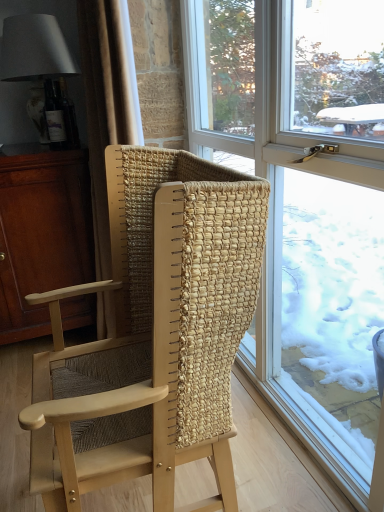
Describe the element at coordinates (154, 334) in the screenshot. Image resolution: width=384 pixels, height=512 pixels. I see `natural woven wood chair at center` at that location.

The image size is (384, 512). What do you see at coordinates (41, 232) in the screenshot?
I see `matte brown cabinet at left` at bounding box center [41, 232].

What do you see at coordinates (306, 206) in the screenshot?
I see `clear glass window at center` at bounding box center [306, 206].

Locate an element on the screen. clear glass window at center is located at coordinates (306, 206).

Find the location of a particular element. natural woven wood chair at center is located at coordinates (154, 334).

Between natural woven wood chair at center and beige woven curtain at left, which one has larger width?

natural woven wood chair at center.

You are a GUI agent. You are given a task and a screenshot of the screen. Output one action in this format:
    pyautogui.click(x=<x>, y=<y>)
    Task: Click on the chair below the beige woven curtain at left (from the image's perspective)
    This screenshot has width=384, height=512.
    Given the screenshot: What is the action you would take?
    pyautogui.click(x=154, y=334)

Is natural woven wood chair at center turned away from beige woven curtain at left?

No, natural woven wood chair at center is not facing the opposite direction of beige woven curtain at left.

From the image's perspective, which is above, natural woven wood chair at center or beige woven curtain at left?

From the image's view, beige woven curtain at left is above.

Can you tell me how much matte white lampshade at upper left and beige woven curtain at left differ in facing direction?

89.2 degrees separate the facing orientations of matte white lampshade at upper left and beige woven curtain at left.

Can you confirm if matte white lampshade at upper left is positioned to the left of beige woven curtain at left?

Correct, you'll find matte white lampshade at upper left to the left of beige woven curtain at left.

From the image's perspective, is matte white lampshade at upper left located beneath beige woven curtain at left?

Incorrect, from the image's perspective, matte white lampshade at upper left is higher than beige woven curtain at left.

Which is in front, matte white lampshade at upper left or beige woven curtain at left?

beige woven curtain at left is closer to the camera.

Could you tell me if natural woven wood chair at center is turned towards clear glass window at center?

No, natural woven wood chair at center is not turned towards clear glass window at center.

Can you confirm if natural woven wood chair at center is positioned to the left of clear glass window at center?

Indeed, natural woven wood chair at center is positioned on the left side of clear glass window at center.

Which object is further away from the camera, natural woven wood chair at center or clear glass window at center?

clear glass window at center is further from the camera.

Choose the correct answer: Is clear glass window at center inside matte white lampshade at upper left or outside it?

clear glass window at center lies outside matte white lampshade at upper left.

Consider the image. Between clear glass window at center and matte white lampshade at upper left, which one appears on the left side from the viewer's perspective?

Positioned to the left is matte white lampshade at upper left.

Considering the sizes of objects clear glass window at center and matte white lampshade at upper left in the image provided, who is shorter, clear glass window at center or matte white lampshade at upper left?

matte white lampshade at upper left is shorter.

Looking at their sizes, would you say clear glass window at center is wider or thinner than matte white lampshade at upper left?

Considering their sizes, clear glass window at center looks slimmer than matte white lampshade at upper left.

Based on the photo, is matte brown cabinet at left located outside natural woven wood chair at center?

Indeed, matte brown cabinet at left is completely outside natural woven wood chair at center.

Is matte brown cabinet at left far from natural woven wood chair at center?

That's not correct — matte brown cabinet at left is a little close to natural woven wood chair at center.

In the scene shown: How far apart are matte brown cabinet at left and natural woven wood chair at center?

matte brown cabinet at left is 30.64 inches from natural woven wood chair at center.

Which is more to the right, matte brown cabinet at left or natural woven wood chair at center?

From the viewer's perspective, natural woven wood chair at center appears more on the right side.

Does matte brown cabinet at left touch clear glass window at center?

matte brown cabinet at left and clear glass window at center are not in contact.

Choose the correct answer: Is matte brown cabinet at left inside clear glass window at center or outside it?

matte brown cabinet at left cannot be found inside clear glass window at center.

Considering the sizes of matte brown cabinet at left and clear glass window at center in the image, is matte brown cabinet at left wider or thinner than clear glass window at center?

matte brown cabinet at left is wider than clear glass window at center.

Would you say clear glass window at center is to the left or to the right of matte brown cabinet at left in the picture?

clear glass window at center is to the right of matte brown cabinet at left.

Would you consider clear glass window at center to be distant from matte brown cabinet at left?

Yes, clear glass window at center and matte brown cabinet at left are located far from each other.

Considering the points (239, 59) and (31, 188), which point is in front, point (239, 59) or point (31, 188)?

The point (31, 188) is closer to the camera.

Is clear glass window at center completely or partially outside of matte brown cabinet at left?

Yes.

Find the location of `curtain above the natural woven wood chair at center (from the image's perspective)`. curtain above the natural woven wood chair at center (from the image's perspective) is located at coordinates click(106, 104).

The width and height of the screenshot is (384, 512). Find the location of `curtain that is below the matte white lampshade at upper left (from the image's perspective)`. curtain that is below the matte white lampshade at upper left (from the image's perspective) is located at coordinates (106, 104).

Looking at the image, which one is located further to natural woven wood chair at center, matte white lampshade at upper left or clear glass window at center?

matte white lampshade at upper left lies further to natural woven wood chair at center than the other object.

Considering their positions, is clear glass window at center positioned closer to matte brown cabinet at left than matte white lampshade at upper left?

Based on the image, matte white lampshade at upper left appears to be nearer to matte brown cabinet at left.

Based on their spatial positions, is matte white lampshade at upper left or clear glass window at center closer to matte brown cabinet at left?

Based on the image, matte white lampshade at upper left appears to be nearer to matte brown cabinet at left.

Based on their spatial positions, is matte white lampshade at upper left or beige woven curtain at left closer to clear glass window at center?

beige woven curtain at left is positioned closer to the anchor clear glass window at center.

From the image, which object appears to be farther from matte brown cabinet at left, clear glass window at center or natural woven wood chair at center?

Based on the image, clear glass window at center appears to be further to matte brown cabinet at left.

Considering their positions, is matte brown cabinet at left positioned closer to matte white lampshade at upper left than natural woven wood chair at center?

Among the two, matte brown cabinet at left is located nearer to matte white lampshade at upper left.

From the image, which object appears to be nearer to beige woven curtain at left, clear glass window at center or natural woven wood chair at center?

Based on the image, natural woven wood chair at center appears to be nearer to beige woven curtain at left.

Looking at the image, which one is located closer to clear glass window at center, natural woven wood chair at center or matte brown cabinet at left?

Based on the image, natural woven wood chair at center appears to be nearer to clear glass window at center.

What are the coordinates of `curtain located between natural woven wood chair at center and matte white lampshade at upper left in the depth direction` in the screenshot? It's located at pos(106,104).

You are a GUI agent. You are given a task and a screenshot of the screen. Output one action in this format:
    pyautogui.click(x=<x>, y=<y>)
    Task: Click on the window located between natural woven wood chair at center and beige woven curtain at left in the depth direction
    
    Given the screenshot: What is the action you would take?
    pyautogui.click(x=306, y=206)

Locate an element on the screen. The width and height of the screenshot is (384, 512). curtain between clear glass window at center and matte white lampshade at upper left along the z-axis is located at coordinates click(106, 104).

Identify the location of curtain between natural woven wood chair at center and matte brown cabinet at left along the z-axis. (106, 104).